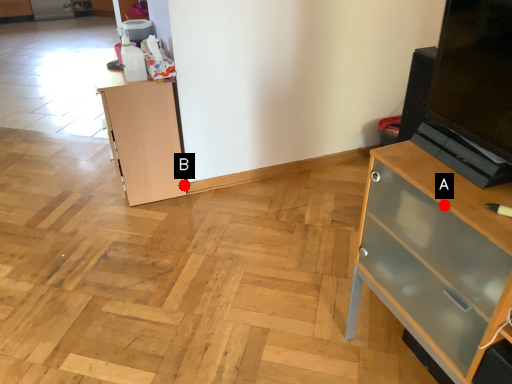
Question: Two points are circled on the image, labeled by A and B beside each circle. Which point is closer to the camera?

Choices:
 (A) A is closer
 (B) B is closer

Answer: (A)